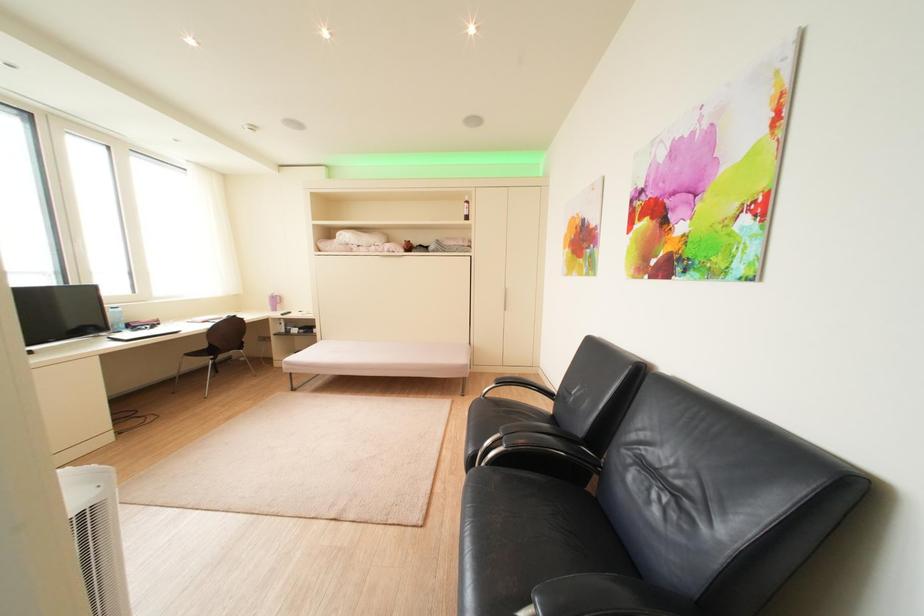
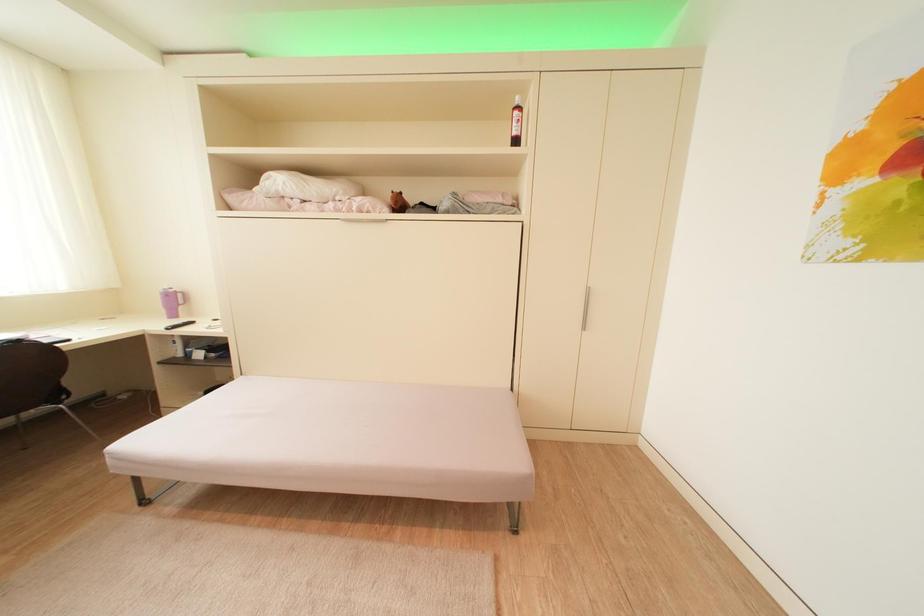
Question: In a continuous first-person perspective shot, in which direction is the camera moving?

Choices:
 (A) Left
 (B) Right
 (C) Forward
 (D) Backward

Answer: (C)